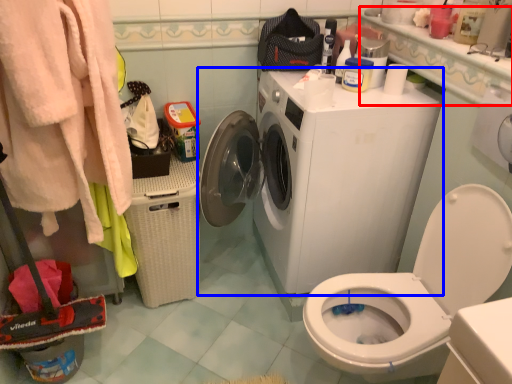
Question: Among these objects, which one is farthest to the camera, counter top (highlighted by a red box) or washing machine (highlighted by a blue box)?

Choices:
 (A) counter top
 (B) washing machine

Answer: (B)